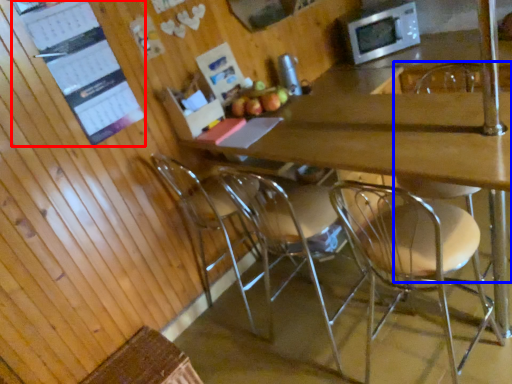
Question: Which of the following is the closest to the observer, bulletin board (highlighted by a red box) or chair (highlighted by a blue box)?

Choices:
 (A) bulletin board
 (B) chair

Answer: (B)